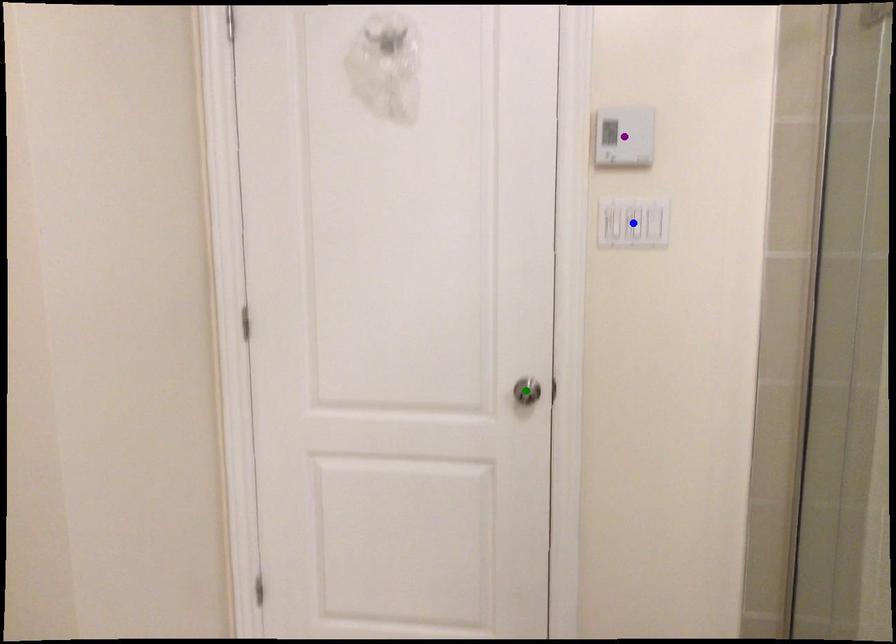
Order these from nearest to farthest:
A) blue point
B) green point
C) purple point

green point, blue point, purple point